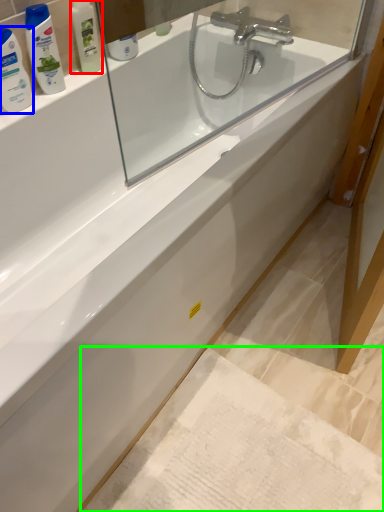
Question: Which is farther away from toiletry (highlighted by a red box)? cleaning product (highlighted by a blue box) or bath mat (highlighted by a green box)?

Choices:
 (A) cleaning product
 (B) bath mat

Answer: (B)